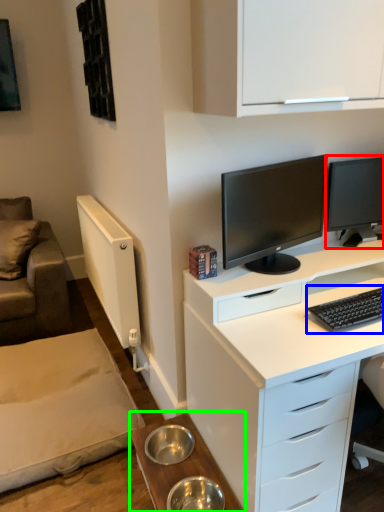
Question: Based on their relative distances, which object is nearer to computer monitor (highlighted by a red box)? Choose from computer keyboard (highlighted by a blue box) and table (highlighted by a green box).

Choices:
 (A) computer keyboard
 (B) table

Answer: (A)